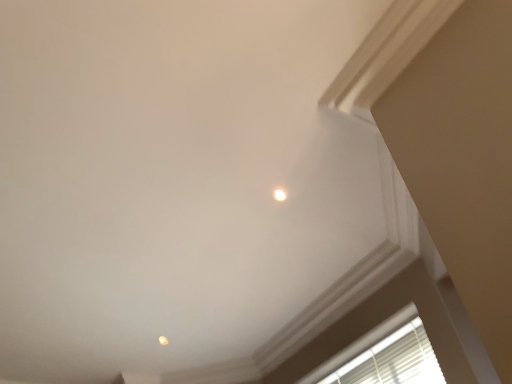
Question: Which direction should I rotate to look at white glossy light fixture at upper center, which is counted as the 1th dot, starting from the top, — up or down?

Choices:
 (A) down
 (B) up

Answer: (A)

Question: Is white blinds at lower right looking in the opposite direction of matte orange light at upper center, marked as the second dot in a top-to-bottom arrangement?

Choices:
 (A) no
 (B) yes

Answer: (A)

Question: Is white blinds at lower right far from matte orange light at upper center, marked as the 1th dot in a left-to-right arrangement?

Choices:
 (A) no
 (B) yes

Answer: (B)

Question: Does white blinds at lower right have a greater width compared to matte orange light at upper center, which is counted as the first dot, starting from the back?

Choices:
 (A) yes
 (B) no

Answer: (A)

Question: From the image's perspective, is white blinds at lower right on top of matte orange light at upper center, placed as the second dot when sorted from right to left?

Choices:
 (A) no
 (B) yes

Answer: (B)

Question: Can you confirm if white blinds at lower right is positioned to the right of matte orange light at upper center, marked as the 1th dot in a left-to-right arrangement?

Choices:
 (A) yes
 (B) no

Answer: (A)

Question: Does white blinds at lower right lie behind matte orange light at upper center, marked as the second dot in a top-to-bottom arrangement?

Choices:
 (A) no
 (B) yes

Answer: (A)

Question: Is matte orange light at upper center, acting as the 2th dot starting from the front, thinner than white blinds at lower right?

Choices:
 (A) yes
 (B) no

Answer: (A)

Question: From the image's perspective, is matte orange light at upper center, marked as the second dot in a top-to-bottom arrangement, located beneath white blinds at lower right?

Choices:
 (A) yes
 (B) no

Answer: (A)

Question: Can you confirm if matte orange light at upper center, arranged as the 1th dot when ordered from the bottom, is bigger than white blinds at lower right?

Choices:
 (A) no
 (B) yes

Answer: (A)

Question: Is matte orange light at upper center, which is counted as the first dot, starting from the back, positioned beyond the bounds of white blinds at lower right?

Choices:
 (A) yes
 (B) no

Answer: (A)

Question: Can you confirm if matte orange light at upper center, marked as the 1th dot in a left-to-right arrangement, is positioned to the left of white blinds at lower right?

Choices:
 (A) no
 (B) yes

Answer: (B)

Question: Is matte orange light at upper center, acting as the 2th dot starting from the front, turned away from white blinds at lower right?

Choices:
 (A) no
 (B) yes

Answer: (A)

Question: Considering the relative positions of white glossy light fixture at upper center, which is counted as the 1th dot, starting from the top, and matte orange light at upper center, acting as the 2th dot starting from the front, in the image provided, is white glossy light fixture at upper center, which is counted as the 1th dot, starting from the top, to the left of matte orange light at upper center, acting as the 2th dot starting from the front, from the viewer's perspective?

Choices:
 (A) yes
 (B) no

Answer: (B)